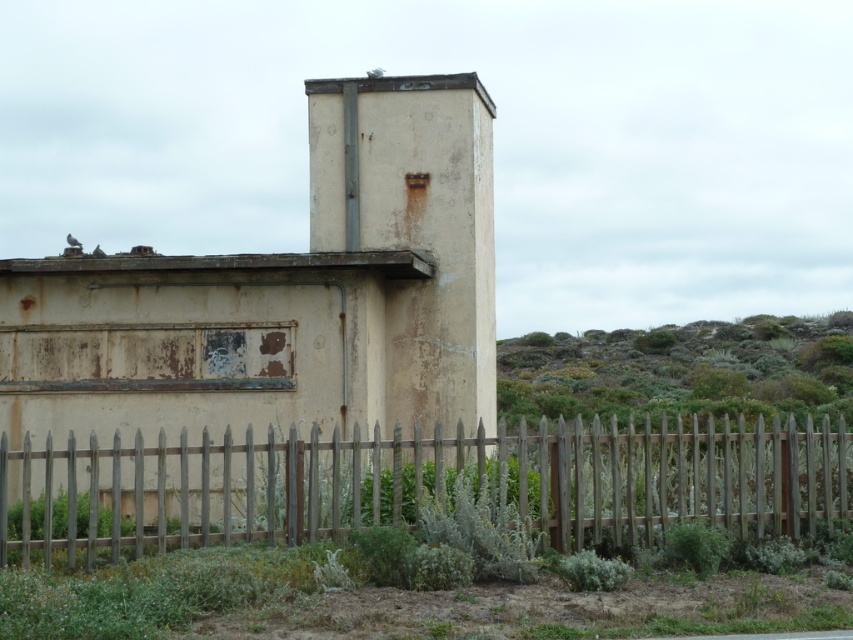
Does rusty concrete chimney at center come in front of weathered wood fence at lower center?

That is False.

Is point (281, 376) less distant than point (650, 476)?

That is False.

Where is `rusty concrete chimney at center`? rusty concrete chimney at center is located at coordinates (286, 292).